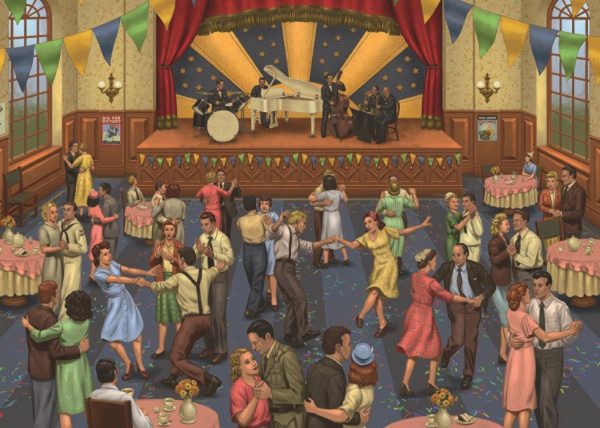
The image size is (600, 428). What are the coordinates of `window on right` in the screenshot? It's located at (574, 117).